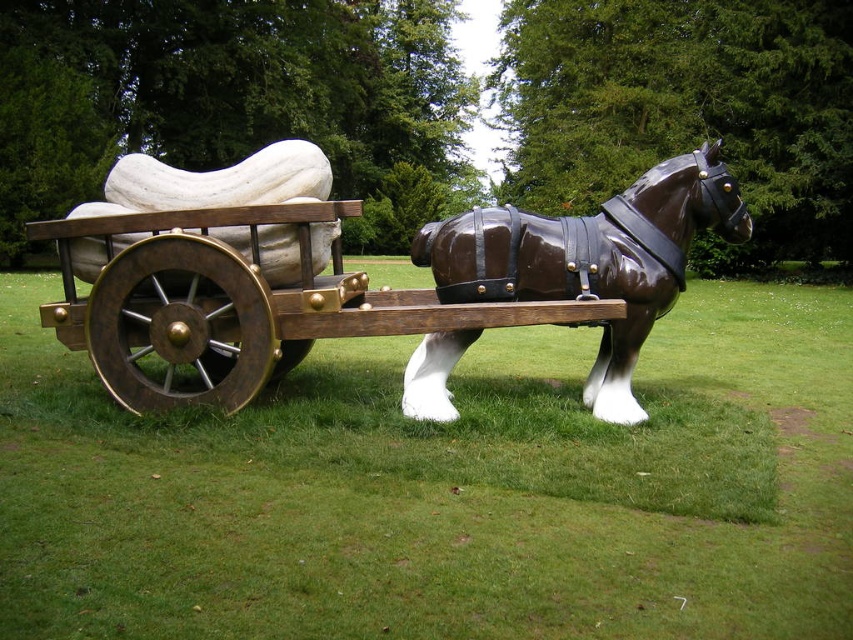
Which is more to the right, shiny brown horse at center or wooden polished wheel at center-left?

From the viewer's perspective, shiny brown horse at center appears more on the right side.

Can you confirm if shiny brown horse at center is positioned above wooden polished wheel at center-left?

Yes.

This screenshot has width=853, height=640. I want to click on shiny brown horse at center, so click(x=593, y=259).

Which of these two, green grass at lower center or shiny brown horse at center, stands taller?

shiny brown horse at center

Does point (33, 464) lie behind point (537, 280)?

No, it is not.

Does point (635, 593) come in front of point (555, 276)?

Yes, point (635, 593) is closer to viewer.

Image resolution: width=853 pixels, height=640 pixels. Identify the location of green grass at lower center. (445, 490).

Does green grass at lower center appear over shiny brown wood cart at center?

No.

I want to click on green grass at lower center, so click(445, 490).